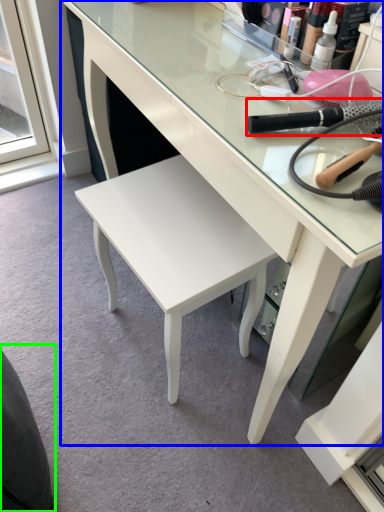
Question: Estimate the real-world distances between objects in this image. Which object is closer to brush (highlighted by a red box), desk (highlighted by a blue box) or swivel chair (highlighted by a green box)?

Choices:
 (A) desk
 (B) swivel chair

Answer: (A)